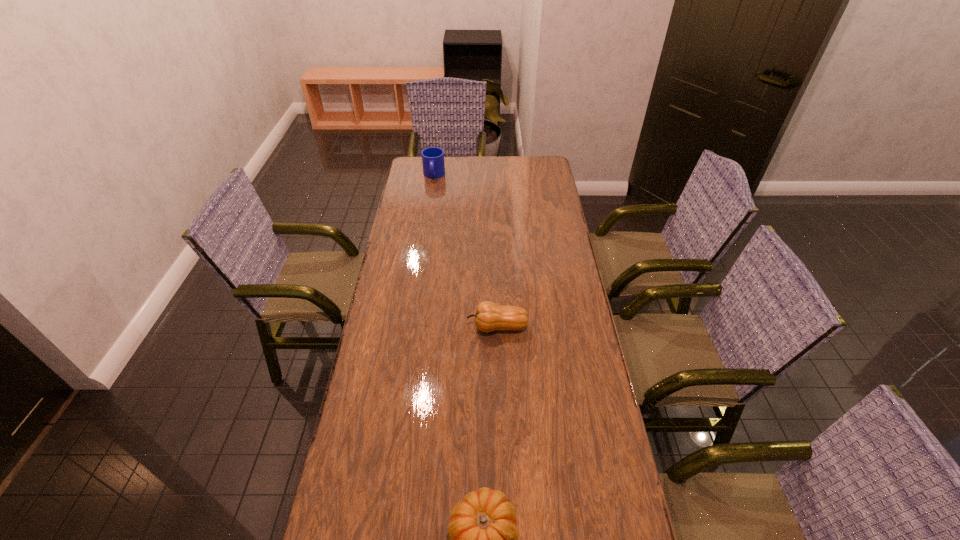
Locate an element on the screen. The width and height of the screenshot is (960, 540). the leftmost object is located at coordinates [433, 157].

In order to click on the farthest object in this screenshot , I will do `click(433, 157)`.

Identify the location of the second nearest object. This screenshot has height=540, width=960. (489, 316).

You are a GUI agent. You are given a task and a screenshot of the screen. Output one action in this format:
    pyautogui.click(x=<x>, y=<y>)
    Task: Click on the free space located 0.180m on the side with the handle of the mug
    
    Given the screenshot: What is the action you would take?
    pyautogui.click(x=430, y=205)

I want to click on vacant space located 0.270m on the stem side of the second farthest object, so click(388, 327).

Locate an element on the screen. vacant region located 0.300m on the stem side of the second farthest object is located at coordinates (379, 327).

At what (x,y) coordinates should I click in order to perform the action: click on free location located on the stem side of the second farthest object. Please return your answer as a coordinate pair (x, y). This screenshot has height=540, width=960. Looking at the image, I should click on (432, 327).

What are the coordinates of `object located in the far edge section of the desktop` in the screenshot? It's located at (433, 157).

Image resolution: width=960 pixels, height=540 pixels. What are the coordinates of `object at the left edge` in the screenshot? It's located at (433, 157).

This screenshot has width=960, height=540. Find the location of `object present at the far left corner`. object present at the far left corner is located at coordinates (433, 157).